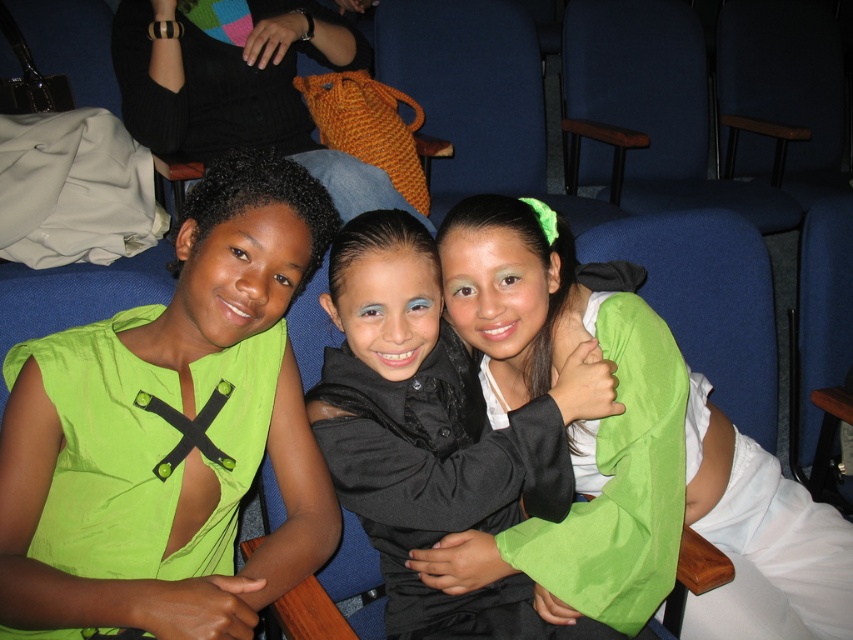
Which is above, lime green fabric shirt at left or matte black jacket at center?

lime green fabric shirt at left is above.

Does lime green fabric shirt at left have a smaller size compared to matte black jacket at center?

Yes.

Identify the location of lime green fabric shirt at left. (171, 432).

Can you confirm if green satin dress at center is positioned above knitted orange bag at upper center?

No, green satin dress at center is not above knitted orange bag at upper center.

Measure the distance between point [532,380] and camera.

Point [532,380] is 1.19 meters away from camera.

The image size is (853, 640). Identify the location of green satin dress at center. (625, 452).

Where is `lime green fabric shirt at left`? This screenshot has height=640, width=853. lime green fabric shirt at left is located at coordinates (171, 432).

Can you confirm if lime green fabric shirt at left is wider than knitted orange bag at upper center?

In fact, lime green fabric shirt at left might be narrower than knitted orange bag at upper center.

Is point (210, 248) closer to viewer compared to point (346, 166)?

Yes.

Locate an element on the screen. This screenshot has width=853, height=640. lime green fabric shirt at left is located at coordinates (171, 432).